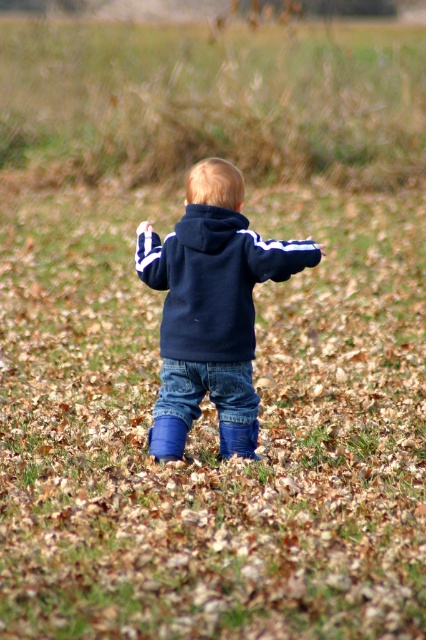
Question: Does green grass at upper center have a larger size compared to navy fleece hoodie at center?

Choices:
 (A) no
 (B) yes

Answer: (B)

Question: Which of the following is the closest to the observer?

Choices:
 (A) navy blue hoodie at center
 (B) green grass at upper center
 (C) navy fleece hoodie at center

Answer: (A)

Question: Which point is closer to the camera?

Choices:
 (A) denim jeans at center
 (B) navy fleece hoodie at center
 (C) navy blue hoodie at center
 (D) green grass at upper center

Answer: (C)

Question: Which object is the closest to the navy fleece hoodie at center?

Choices:
 (A) navy blue hoodie at center
 (B) denim jeans at center
 (C) green grass at upper center

Answer: (A)

Question: From the image, what is the correct spatial relationship of green grass at upper center in relation to navy blue hoodie at center?

Choices:
 (A) below
 (B) above

Answer: (B)

Question: Is green grass at upper center smaller than navy blue hoodie at center?

Choices:
 (A) yes
 (B) no

Answer: (B)